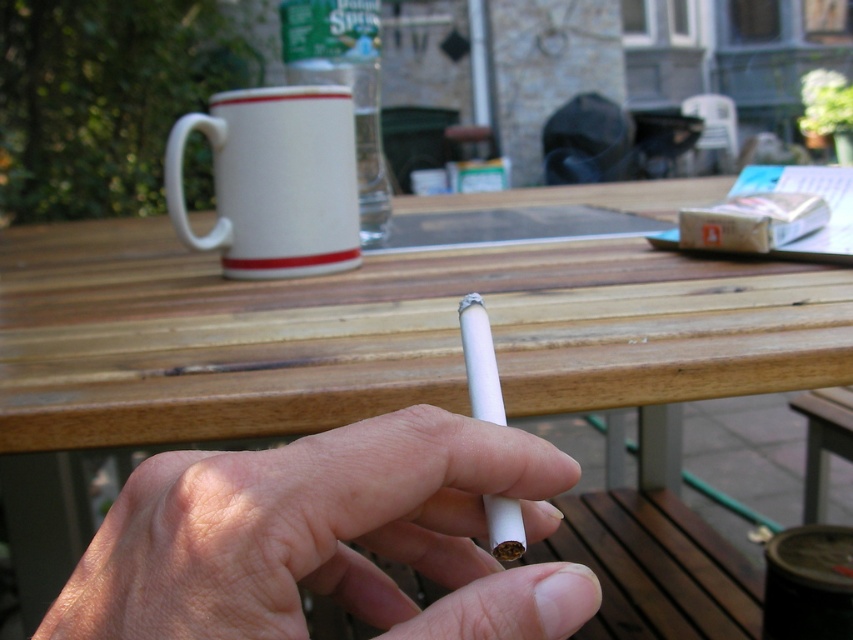
Question: Among these objects, which one is farthest from the camera?

Choices:
 (A) wooden picnic table at center
 (B) white matte cigarette at center
 (C) white ceramic mug at upper center

Answer: (C)

Question: Which object appears closest to the camera in this image?

Choices:
 (A) wooden picnic table at center
 (B) white ceramic mug at upper center

Answer: (A)

Question: Does white matte cigarette at center have a greater width compared to white ceramic mug at upper center?

Choices:
 (A) yes
 (B) no

Answer: (B)

Question: Which point appears farthest from the camera in this image?

Choices:
 (A) click(x=418, y=413)
 (B) click(x=332, y=109)
 (C) click(x=672, y=209)

Answer: (C)

Question: Is white matte cigarette at center below white ceramic mug at upper center?

Choices:
 (A) no
 (B) yes

Answer: (B)

Question: Can you confirm if white matte cigarette at center is wider than white ceramic mug at upper center?

Choices:
 (A) no
 (B) yes

Answer: (A)